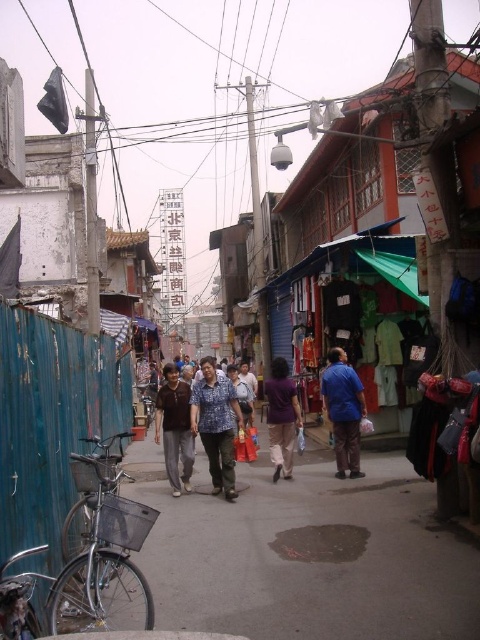
Is gray concrete pavement at center thinner than purple matte shirt at center?

No, gray concrete pavement at center is not thinner than purple matte shirt at center.

The height and width of the screenshot is (640, 480). In order to click on gray concrete pavement at center in this screenshot , I will do `click(305, 554)`.

Which of these two, brown matte shirt at center or purple matte shirt at center, stands shorter?

With less height is purple matte shirt at center.

Where is `brown matte shirt at center`? This screenshot has height=640, width=480. brown matte shirt at center is located at coordinates (175, 428).

Is blue printed shirt at center to the left of blue matte shirt at center from the viewer's perspective?

Indeed, blue printed shirt at center is positioned on the left side of blue matte shirt at center.

Between blue printed shirt at center and blue matte shirt at center, which one is positioned lower?

blue matte shirt at center is below.

Measure the distance between blue printed shirt at center and camera.

7.75 meters

The height and width of the screenshot is (640, 480). I want to click on blue printed shirt at center, so click(x=216, y=426).